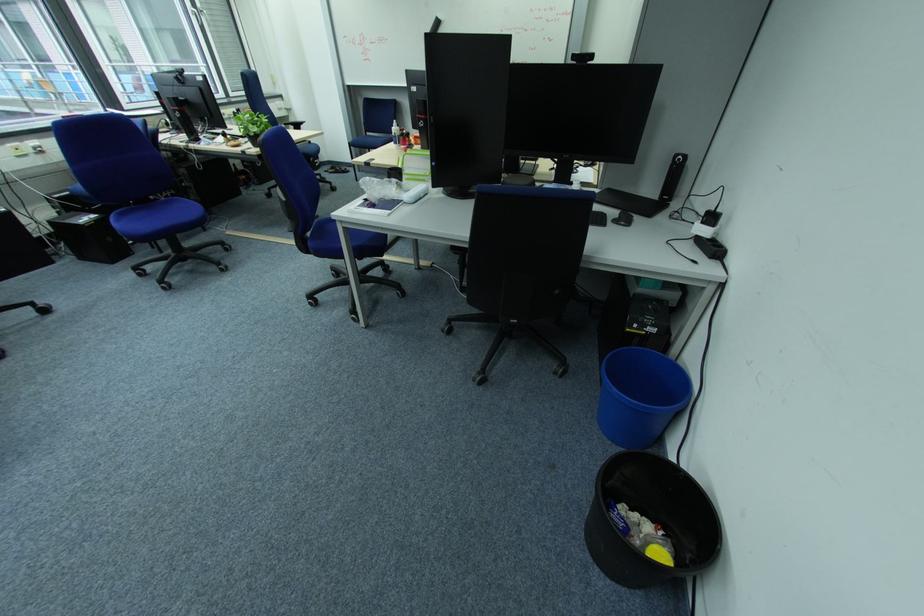
Locate an element on the screen. This screenshot has height=616, width=924. blue trash can is located at coordinates (639, 395).